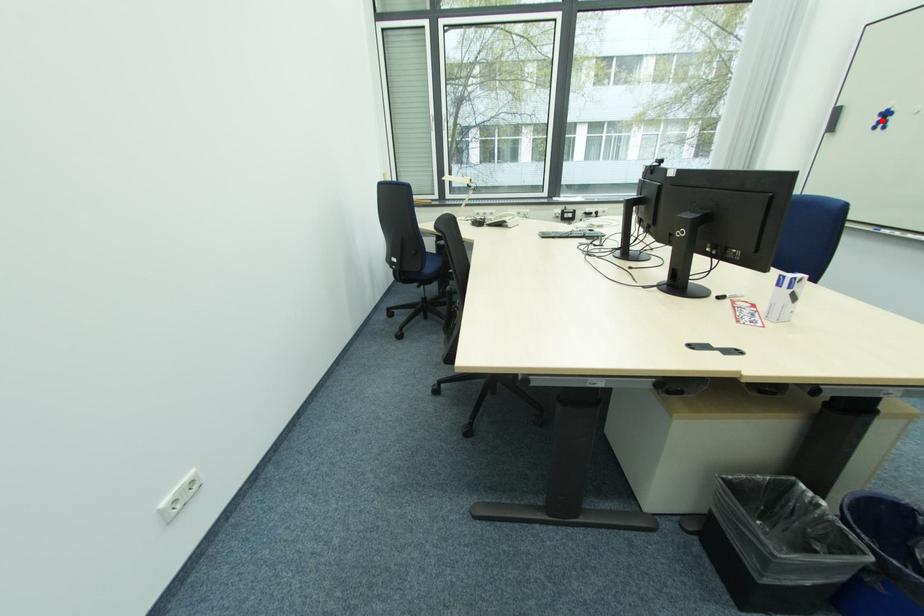
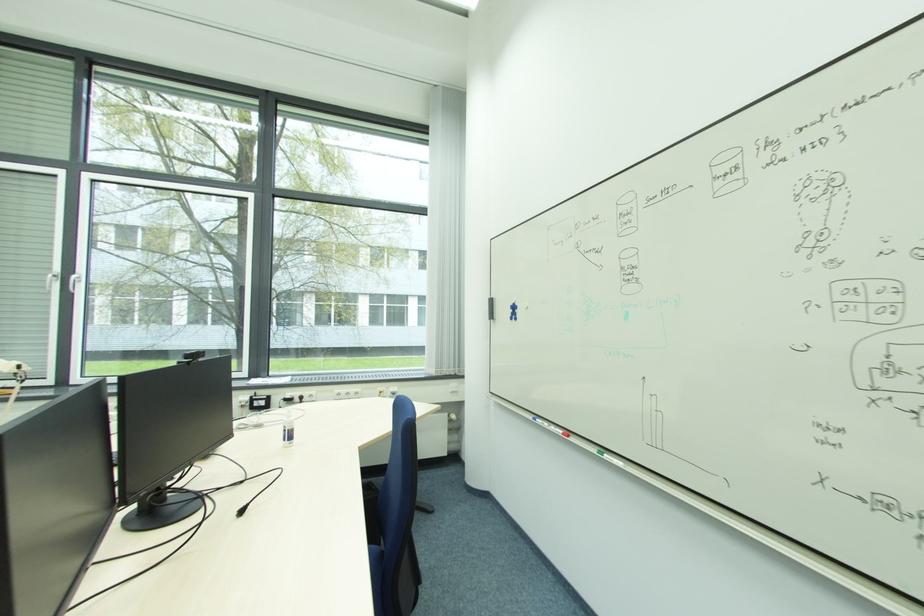
Question: I am providing you with two images of the same scene from different viewpoints. A red point is shown in image1. For the corresponding object point in image2, is it positioned nearer or farther from the camera?

Choices:
 (A) Nearer
 (B) Farther

Answer: (A)